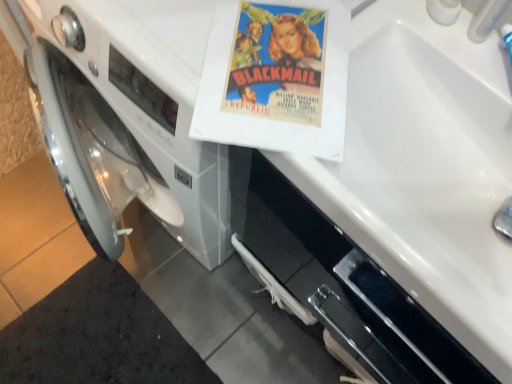
Question: Considering the positions of point (438, 152) and point (475, 36), is point (438, 152) closer or farther from the camera than point (475, 36)?

Choices:
 (A) closer
 (B) farther

Answer: (B)

Question: From the image's perspective, relative to white plastic faucet at upper right, is white glossy sink at upper right above or below?

Choices:
 (A) below
 (B) above

Answer: (A)

Question: Which of these objects is positioned closest to the white glossy sink at upper right?

Choices:
 (A) matte paper poster at center
 (B) white plastic faucet at upper right

Answer: (A)

Question: Based on their relative distances, which object is farther from the matte paper poster at center?

Choices:
 (A) white plastic faucet at upper right
 (B) white glossy sink at upper right

Answer: (B)